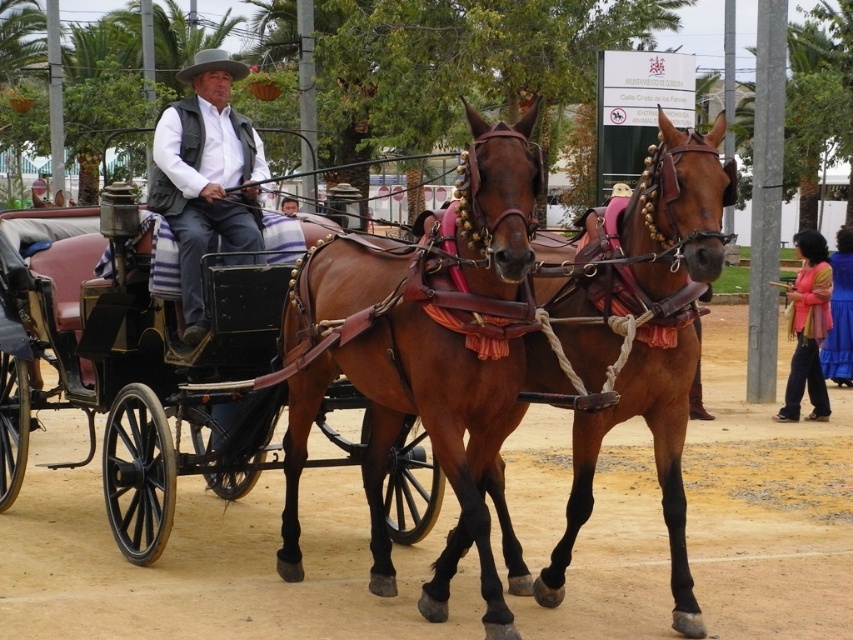
Question: Can you confirm if shiny brown leather cart at center is bigger than blue satin dress at lower right?

Choices:
 (A) no
 (B) yes

Answer: (B)

Question: Estimate the real-world distances between objects in this image. Which object is farther from the pink fabric dress at lower right?

Choices:
 (A) blue satin dress at lower right
 (B) matte black vest at center
 (C) shiny brown leather cart at center
 (D) brown glossy horse at center

Answer: (D)

Question: Which point is closer to the camera?

Choices:
 (A) (200, 96)
 (B) (564, 385)

Answer: (B)

Question: Estimate the real-world distances between objects in this image. Which object is farther from the matte black vest at center?

Choices:
 (A) shiny brown leather cart at center
 (B) blue satin dress at lower right
 (C) brown glossy horse at center

Answer: (B)

Question: In this image, where is shiny brown horse at center located relative to pink fabric dress at lower right?

Choices:
 (A) below
 (B) above

Answer: (B)

Question: Is shiny brown horse at center bigger than pink fabric dress at lower right?

Choices:
 (A) no
 (B) yes

Answer: (B)